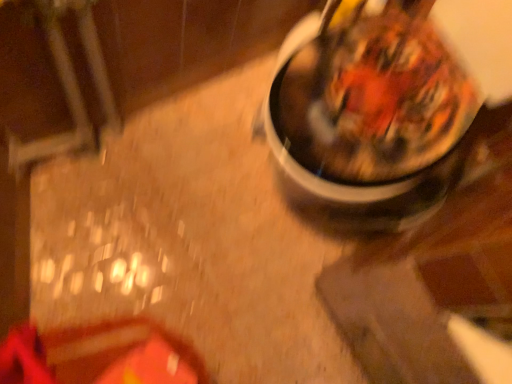
In order to click on white glossy mug at upper center in this screenshot , I will do `click(369, 118)`.

What do you see at coordinates (369, 118) in the screenshot? I see `white glossy mug at upper center` at bounding box center [369, 118].

This screenshot has width=512, height=384. Identify the location of white glossy mug at upper center. (369, 118).